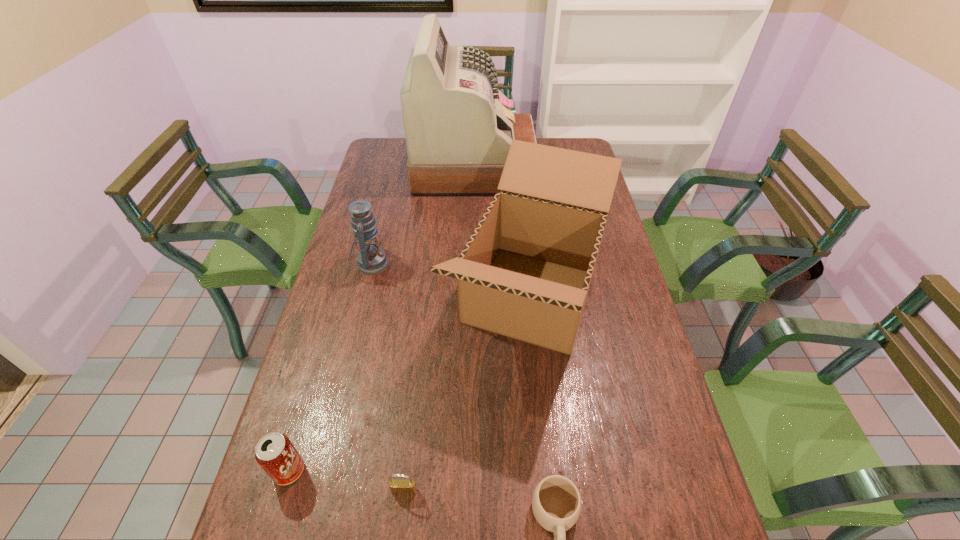
Locate an element on the screen. free space located 0.080m on the front-facing side of the padlock is located at coordinates (399, 537).

At what (x,y) coordinates should I click in order to perform the action: click on object positioned at the far edge. Please return your answer as a coordinate pair (x, y). The width and height of the screenshot is (960, 540). Looking at the image, I should click on (459, 126).

Where is `lantern that is at the left edge`? This screenshot has height=540, width=960. lantern that is at the left edge is located at coordinates (372, 260).

The height and width of the screenshot is (540, 960). I want to click on soda can positioned at the left edge, so click(275, 453).

Find the location of a particular element. Image resolution: width=960 pixels, height=540 pixels. object positioned at the right edge is located at coordinates (525, 272).

The height and width of the screenshot is (540, 960). I want to click on vacant area at the left edge, so click(251, 532).

What are the coordinates of `vacant region at the right edge of the desktop` in the screenshot? It's located at (603, 245).

Identify the location of free spot between the padlock and the third tallest object. The image size is (960, 540). (388, 377).

Where is `free area in between the fifth shortest object and the lantern`? Image resolution: width=960 pixels, height=540 pixels. free area in between the fifth shortest object and the lantern is located at coordinates (450, 281).

Find the location of `free space between the lantern and the fifth tallest object`. free space between the lantern and the fifth tallest object is located at coordinates (388, 377).